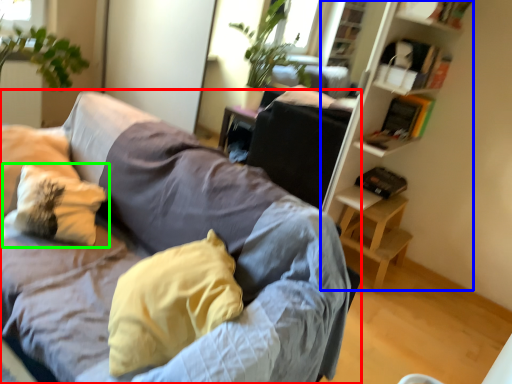
Question: Which is farther away from studio couch (highlighted by a red box)? bookshelf (highlighted by a blue box) or pillow (highlighted by a green box)?

Choices:
 (A) bookshelf
 (B) pillow

Answer: (A)